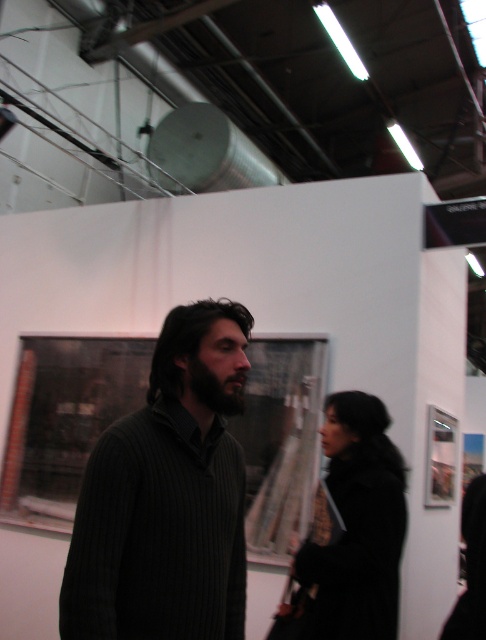
Does dark ribbed sweater at center appear over black wool coat at center?

Indeed, dark ribbed sweater at center is positioned over black wool coat at center.

Which is behind, point (241, 305) or point (324, 563)?

Positioned behind is point (324, 563).

Who is more forward, (114, 486) or (354, 468)?

Positioned in front is point (114, 486).

Where is `dark ribbed sweater at center`? The height and width of the screenshot is (640, 486). dark ribbed sweater at center is located at coordinates (168, 497).